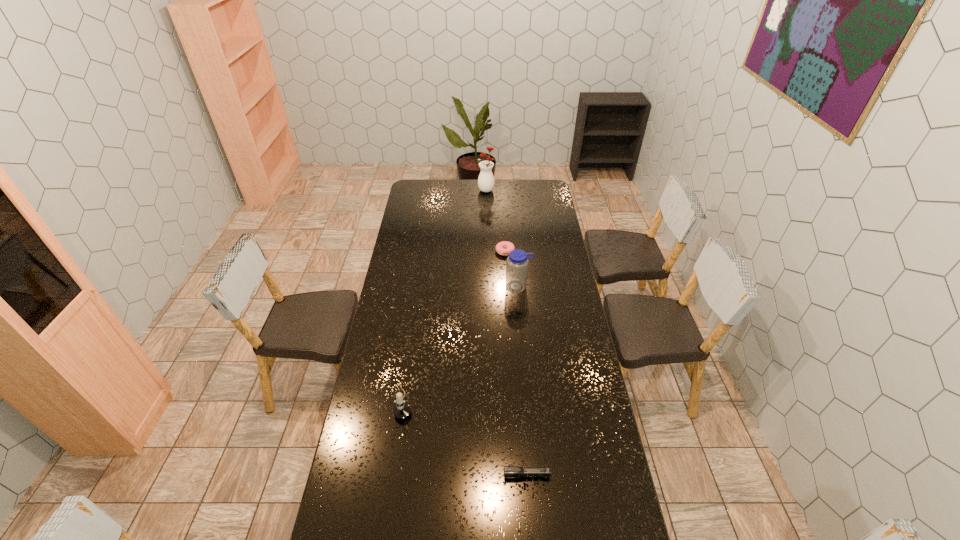
In order to click on the tallest object in this screenshot , I will do `click(486, 179)`.

Locate an element on the screen. The image size is (960, 540). the farthest object is located at coordinates (486, 179).

Image resolution: width=960 pixels, height=540 pixels. I want to click on the second tallest object, so click(517, 262).

You are a GUI agent. You are given a task and a screenshot of the screen. Output one action in this format:
    pyautogui.click(x=<x>, y=<y>)
    Task: Click on the third farthest object
    
    Given the screenshot: What is the action you would take?
    pyautogui.click(x=517, y=262)

Find the location of a particular element. the third shortest object is located at coordinates click(x=402, y=410).

Find the location of a particular element. the fourth farthest object is located at coordinates (402, 410).

The width and height of the screenshot is (960, 540). What are the coordinates of `the fourth nearest object` in the screenshot? It's located at (500, 247).

Image resolution: width=960 pixels, height=540 pixels. In order to click on the nearest object in this screenshot , I will do coord(509,471).

Identify the location of blank area located 0.270m on the front of the tallest object. (488, 220).

Where is `free space located with a carrying loop on the side of the third nearest object`? Image resolution: width=960 pixels, height=540 pixels. free space located with a carrying loop on the side of the third nearest object is located at coordinates (525, 355).